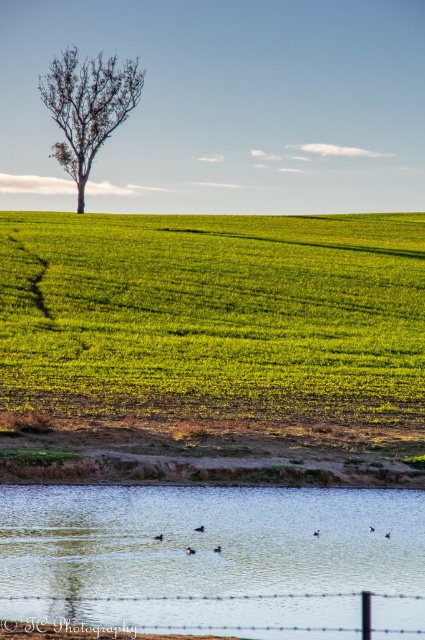
Does green grassy field at center appear under clear water at lower center?

Incorrect, green grassy field at center is not positioned below clear water at lower center.

Between point (144, 285) and point (329, 582), which one is positioned in front?

Positioned in front is point (329, 582).

Identify the location of green grassy field at center. (212, 314).

Does clear water at lower center appear under barbed wire fence at lower center?

Yes.

Which is above, clear water at lower center or barbed wire fence at lower center?

Positioned higher is barbed wire fence at lower center.

Is point (329, 614) closer to camera compared to point (87, 618)?

No, (329, 614) is behind (87, 618).

You are a GUI agent. You are given a task and a screenshot of the screen. Output one action in this format:
    pyautogui.click(x=<x>, y=<y>)
    Task: Click on the clear water at lower center
    This screenshot has height=640, width=425.
    Given the screenshot: What is the action you would take?
    pos(214,557)

Who is positioned more to the left, clear water at lower center or bare brown tree at upper left?

bare brown tree at upper left is more to the left.

Is clear water at lower center positioned at the back of bare brown tree at upper left?

That is False.

Identify the location of clear water at lower center. The height and width of the screenshot is (640, 425). (214, 557).

Locate an element on the screen. The image size is (425, 640). clear water at lower center is located at coordinates (214, 557).